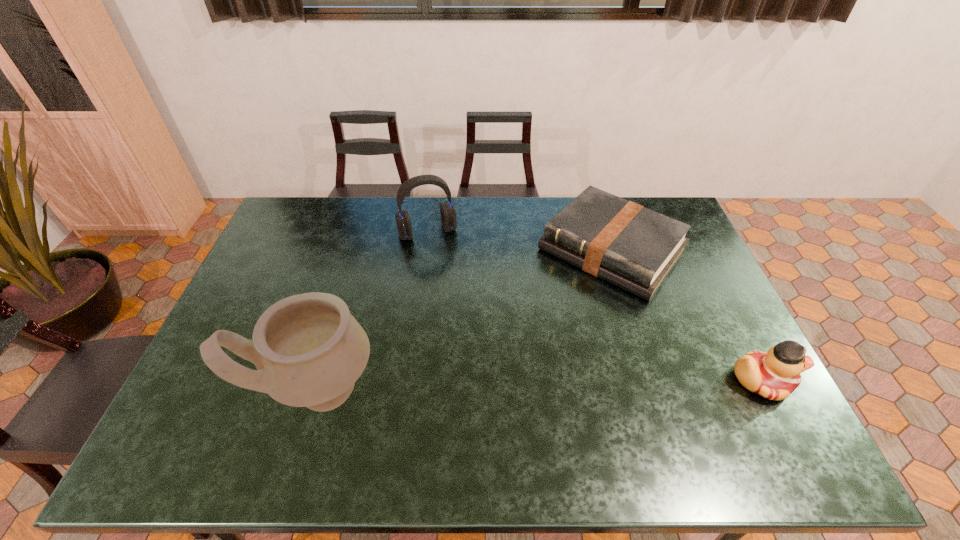
This screenshot has width=960, height=540. What are the coordinates of `vacant spot on the desktop that is between the tallest object and the duck and is positioned on the headband of the second tallest object` in the screenshot? It's located at (488, 386).

Image resolution: width=960 pixels, height=540 pixels. I want to click on vacant space on the desktop that is between the tallest object and the duck and is positioned on the spine side of the shortest object, so click(494, 386).